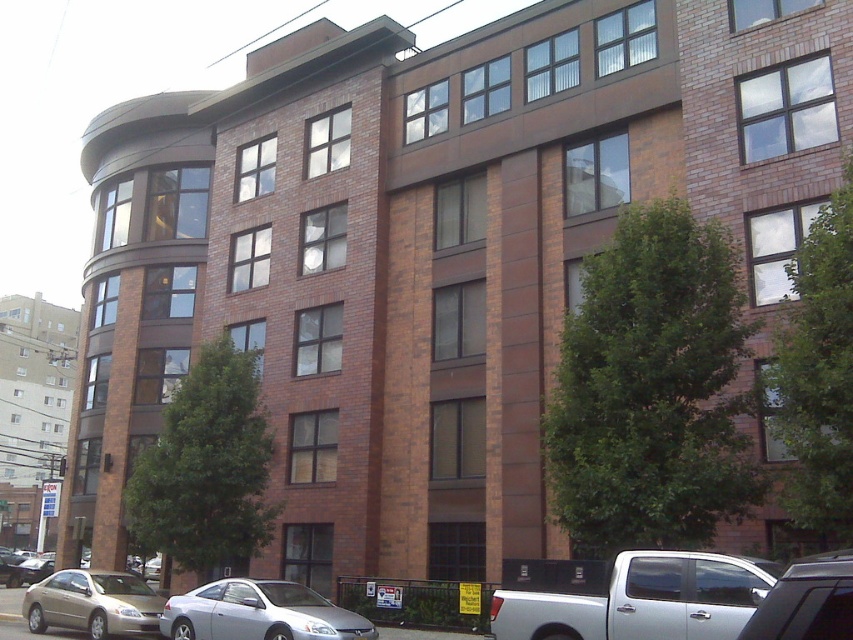
Consider the image. You are a delivery driver who needs to park your vehicle between the matte gold sedan at lower left and the silver metallic car at lower right. Based on the scene description, which vehicle should you park closer to if your truck is wider than both?

Since the matte gold sedan at lower left is larger than the silver metallic car at lower right, you should park closer to the silver metallic car at lower right to accommodate your wider truck.

You are a delivery person trying to park your van between the silver metallic car at lower center and the silver metallic car at lower right. Can you fit your van, which is 1.5 meters wider than the smaller silver metallic car, in the space between them?

The silver metallic car at lower center is larger than the silver metallic car at lower right. Since your van is 1.5 meters wider than the smaller car, you need to compare the space between them. However, without knowing the exact distance between the two cars, it is impossible to determine if the van will fit. Please check the available space physically.